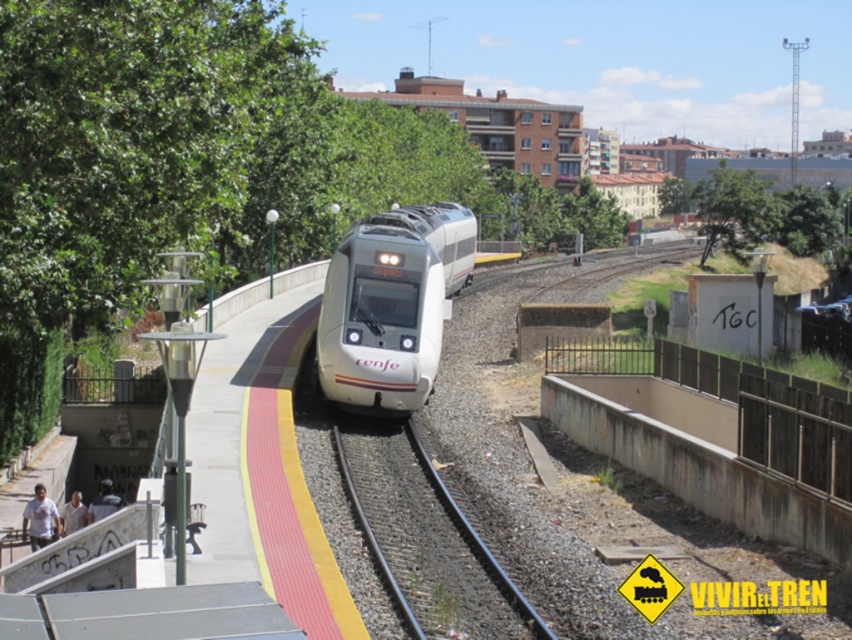
Question: Which object appears farthest from the camera in this image?

Choices:
 (A) white glossy bullet train at center
 (B) green leafy tree at upper right

Answer: (B)

Question: Among these objects, which one is farthest from the camera?

Choices:
 (A) black metal train track at center
 (B) white glossy bullet train at center

Answer: (B)

Question: Does black metal train track at center have a greater width compared to green leafy tree at upper right?

Choices:
 (A) yes
 (B) no

Answer: (B)

Question: Can you confirm if black metal train track at center is smaller than green leafy tree at upper right?

Choices:
 (A) no
 (B) yes

Answer: (B)

Question: Which point is closer to the camera?

Choices:
 (A) (833, 202)
 (B) (337, 296)
 (C) (367, 529)

Answer: (C)

Question: Can you confirm if black metal train track at center is positioned below green leafy tree at upper right?

Choices:
 (A) no
 (B) yes

Answer: (B)